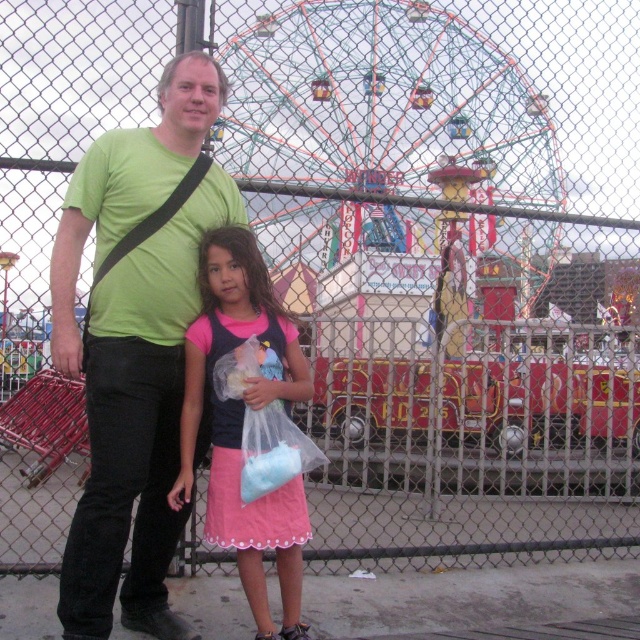
You are standing at the point with coordinates (134, 346) in the image. What object is located at this point?

The point at coordinates (134, 346) corresponds to the green matte t shirt at center.